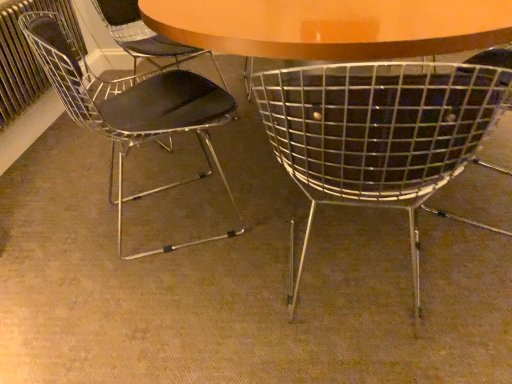
The height and width of the screenshot is (384, 512). I want to click on free space to the right of metal mesh chair at center, which is the second chair in left-to-right order, so click(461, 271).